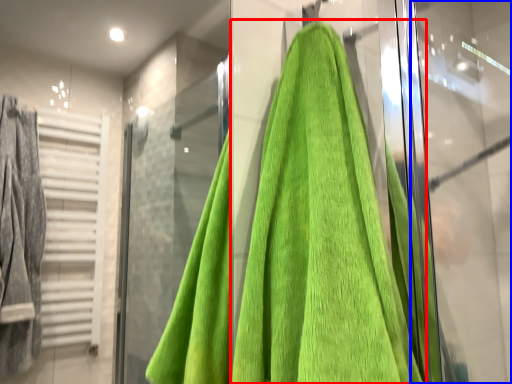
Question: Which of the following is the farthest to the observer, towel (highlighted by a red box) or screen door (highlighted by a blue box)?

Choices:
 (A) towel
 (B) screen door

Answer: (B)